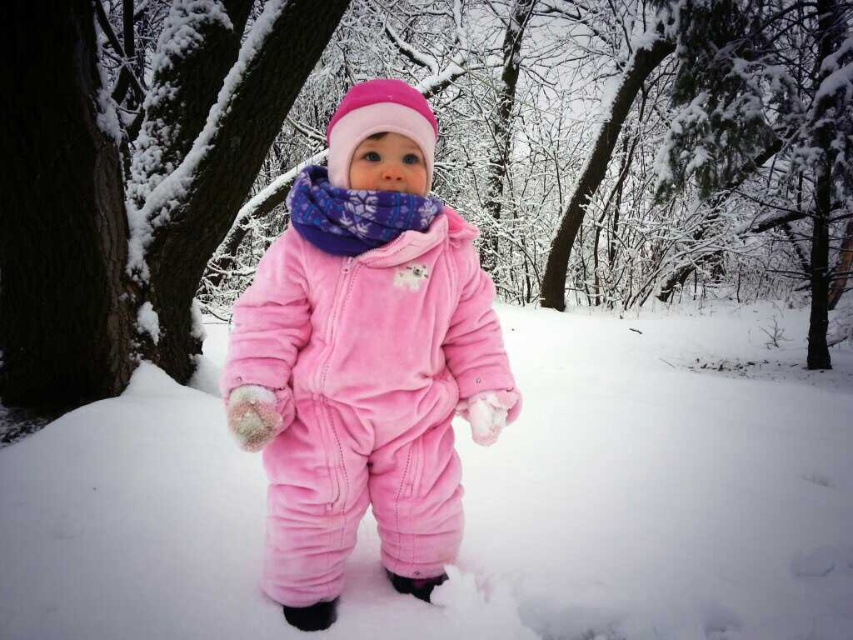
Does smooth bark tree at center come behind snow-covered bark tree at left?

No.

Who is taller, smooth bark tree at center or snow-covered bark tree at left?

With more height is smooth bark tree at center.

Identify the location of smooth bark tree at center. (663, 148).

Based on the photo, who is more forward, (688,586) or (438,387)?

Point (438,387)

Is point (828, 372) behind point (477, 291)?

Yes, point (828, 372) is behind point (477, 291).

Is point (676, 509) closer to viewer compared to point (337, 400)?

No, (676, 509) is behind (337, 400).

This screenshot has width=853, height=640. I want to click on velvety pink snowsuit at center, so click(x=474, y=502).

From the picture: Between smooth bark tree at center and velvety pink snowsuit at center, which one has less height?

velvety pink snowsuit at center is shorter.

Locate an element on the screen. The height and width of the screenshot is (640, 853). smooth bark tree at center is located at coordinates (663, 148).

Identify the location of smooth bark tree at center. This screenshot has height=640, width=853. (663, 148).